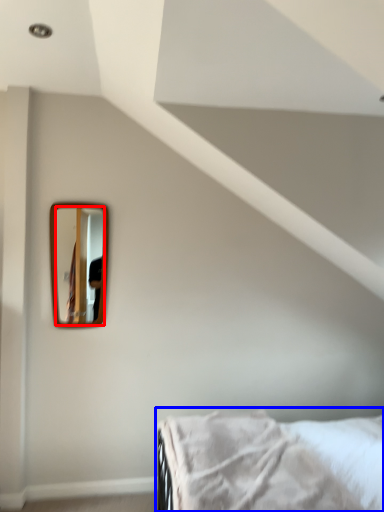
Question: Which of the following is the farthest to the observer, mirror (highlighted by a red box) or bed (highlighted by a blue box)?

Choices:
 (A) mirror
 (B) bed

Answer: (A)